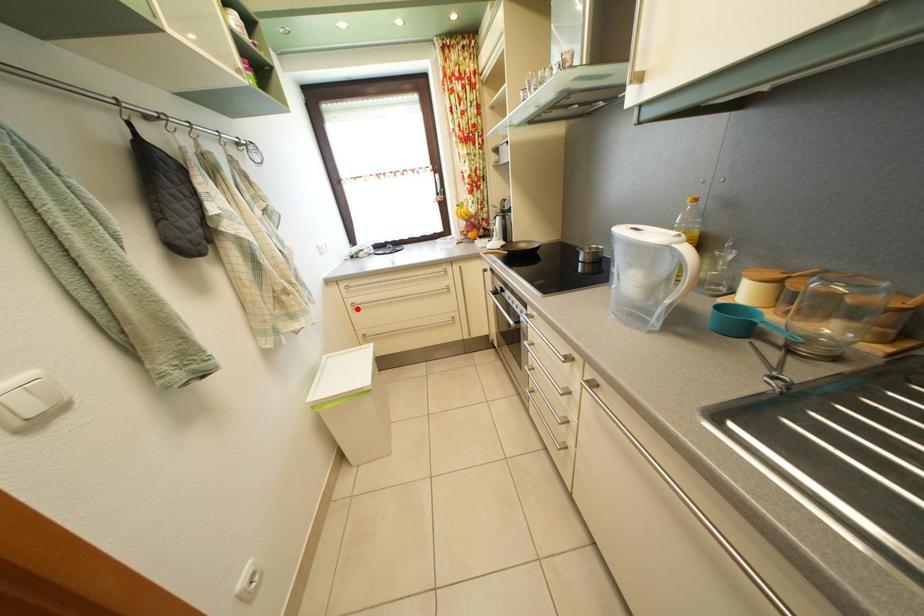
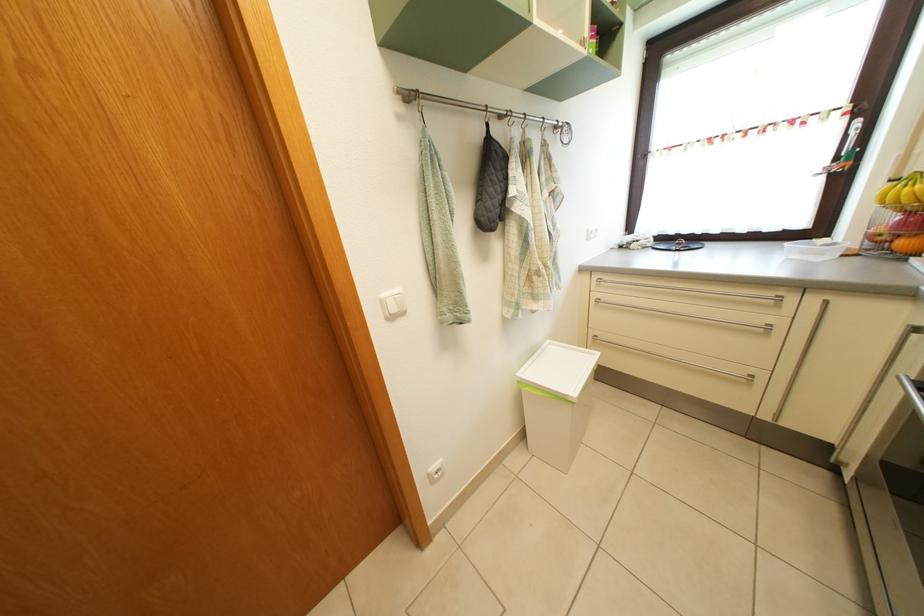
Question: I am providing you with two images of the same scene from different viewpoints. A red point is marked on the first image. Can you still see the location of the red point in image 2?

Choices:
 (A) Yes
 (B) No

Answer: (A)